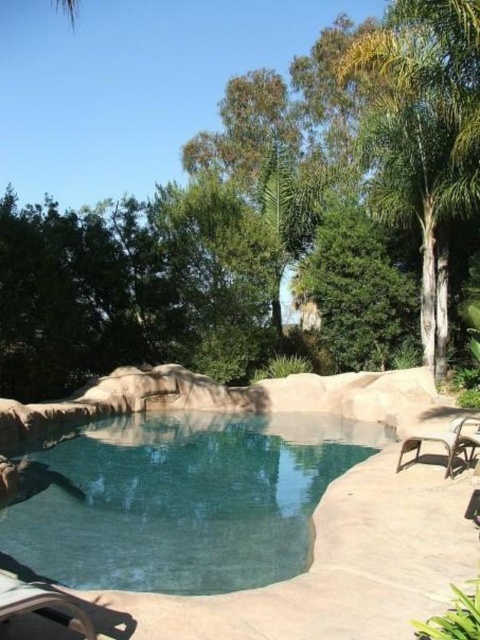
Question: Which of the following is the closest to the observer?

Choices:
 (A) (0, 586)
 (B) (408, 438)

Answer: (A)

Question: Does clear blue water at center have a smaller size compared to metallic silver chair at lower left?

Choices:
 (A) no
 (B) yes

Answer: (B)

Question: Which of the following is the farthest from the observer?

Choices:
 (A) (103, 486)
 (B) (421, 435)

Answer: (A)

Question: Does metallic silver chair at lower left appear on the left side of brown woven chair at lower right?

Choices:
 (A) no
 (B) yes

Answer: (B)

Question: Does metallic silver chair at lower left appear on the left side of brown woven chair at lower right?

Choices:
 (A) yes
 (B) no

Answer: (A)

Question: Among these points, which one is farthest from the camera?

Choices:
 (A) (446, 461)
 (B) (58, 614)
 (C) (192, 484)

Answer: (C)